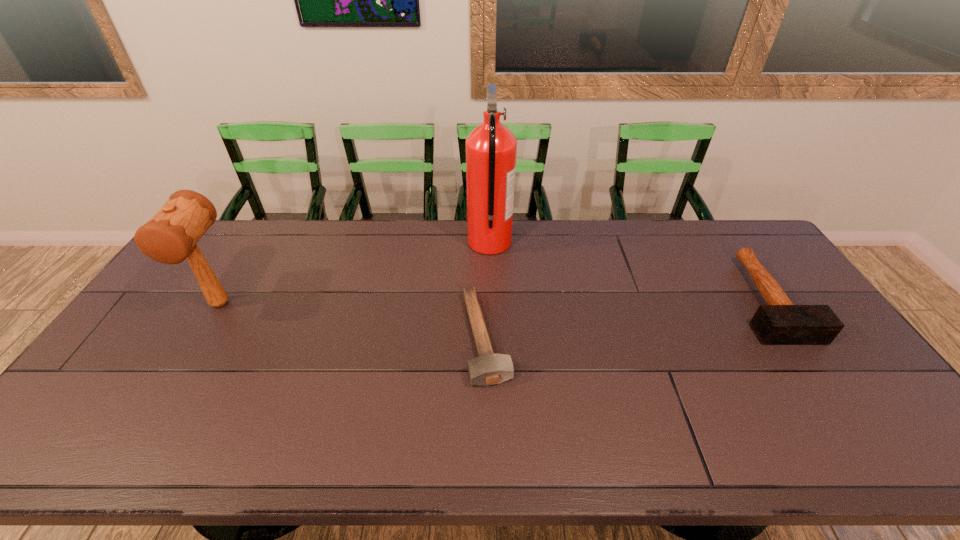
This screenshot has height=540, width=960. Identify the location of vacant space at the left edge. (180, 284).

The image size is (960, 540). In order to click on free space at the right edge in this screenshot , I will do `click(887, 410)`.

In the image, there is a desktop. Identify the location of free space at the far right corner. (743, 227).

Find the location of a particular element. blank region between the tallest object and the second tallest mallet is located at coordinates (627, 271).

The width and height of the screenshot is (960, 540). I want to click on free spot between the second shortest mallet and the leftmost object, so click(492, 301).

What are the coordinates of `blank region between the second shortest object and the leftmost mallet` in the screenshot? It's located at (492, 301).

Find the location of a particular element. free space between the second shortest object and the shortest mallet is located at coordinates tap(625, 318).

I want to click on free space between the shortest object and the tallest mallet, so click(353, 321).

Identify the location of unoccupied position between the rightmost object and the leftmost object. (492, 301).

Where is `blank region between the tallest object and the second shortest mallet`? Image resolution: width=960 pixels, height=540 pixels. blank region between the tallest object and the second shortest mallet is located at coordinates (627, 271).